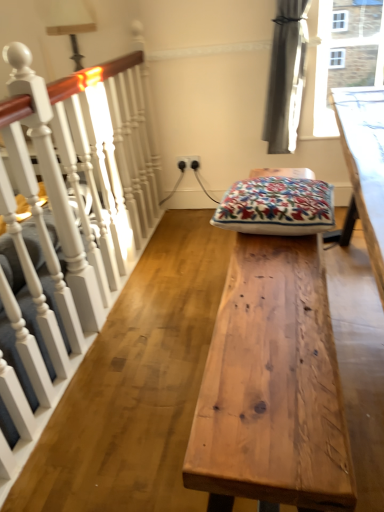
The width and height of the screenshot is (384, 512). What are the coordinates of `free space above natural wood table at center (from a real-world perspective)` in the screenshot? It's located at (270, 304).